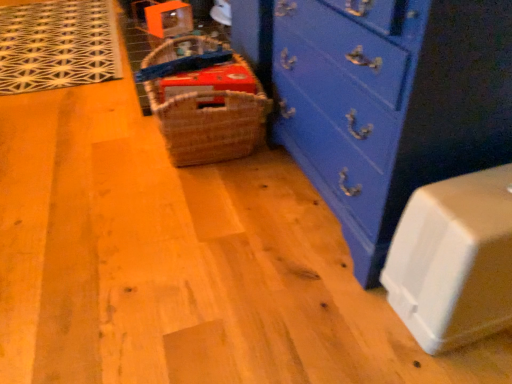
Locate an element on the screen. The height and width of the screenshot is (384, 512). free location to the left of woven brown basket at center is located at coordinates (99, 141).